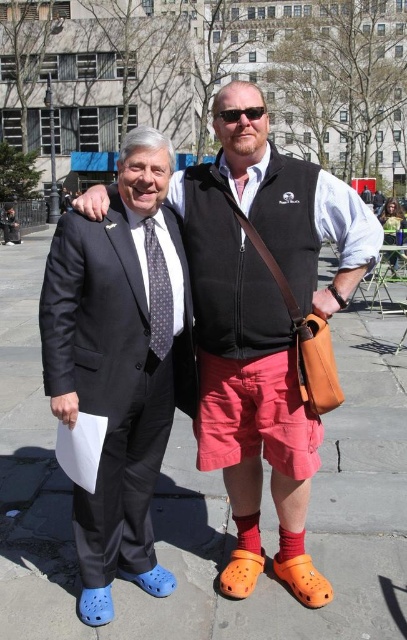
You are a photographer setting up for a group photo. You notice the gray concrete pavement at center and the sunglasses at center in the scene. Which object is wider when viewed from above?

The gray concrete pavement at center is wider than the sunglasses at center.

Consider the image. You are a photographer trying to capture a closeup shot of the dark gray dotted tie at center and the sunglasses at center. Since you want to focus on both objects equally, which object should you adjust your camera focus on first considering their sizes?

The dark gray dotted tie at center is larger in size compared to the sunglasses at center, so you should focus on the dark gray dotted tie at center first to ensure it is in clear view before adjusting for the smaller sunglasses at center.

You are trying to determine which object is taller between the gray concrete pavement at center and the sunglasses at center. Based on the scene description, which one is taller?

The gray concrete pavement at center is taller than the sunglasses at center according to the description.